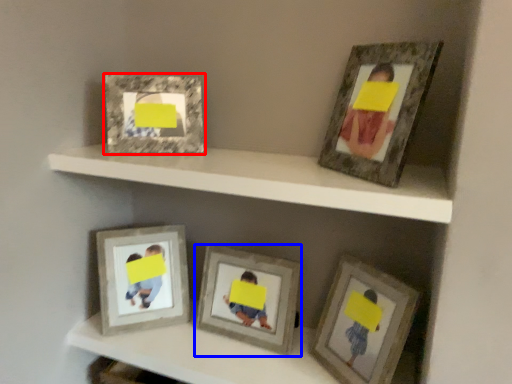
Question: Which of the following is the farthest to the observer, picture frame (highlighted by a red box) or picture frame (highlighted by a blue box)?

Choices:
 (A) picture frame
 (B) picture frame

Answer: (B)